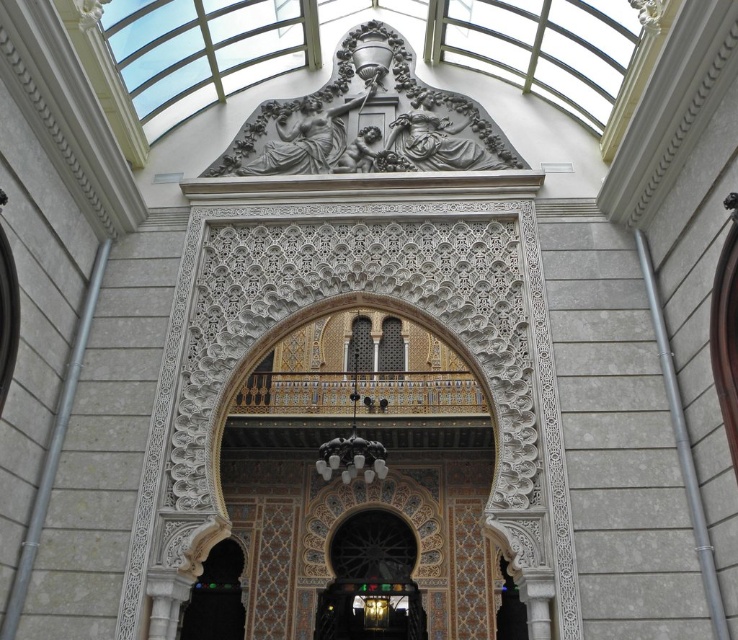
Does metallic gold door at lower center have a lesser width compared to dark wood door at lower left?

Indeed, metallic gold door at lower center has a lesser width compared to dark wood door at lower left.

Does metallic gold door at lower center have a smaller size compared to dark wood door at lower left?

→ Correct, metallic gold door at lower center occupies less space than dark wood door at lower left.

Between point (351, 596) and point (204, 609), which one is positioned behind?

Positioned behind is point (351, 596).

Find the location of `metallic gold door at lower center`. metallic gold door at lower center is located at coordinates (369, 611).

Is gray stone relief at upper center bigger than metallic gold door at lower center?

Yes.

Is gray stone relief at upper center to the right of metallic gold door at lower center from the viewer's perspective?

In fact, gray stone relief at upper center is to the left of metallic gold door at lower center.

Measure the distance between point (356, 100) and camera.

They are 58.84 meters apart.

You are a GUI agent. You are given a task and a screenshot of the screen. Output one action in this format:
    pyautogui.click(x=<x>, y=<y>)
    Task: Click on the gray stone relief at upper center
    
    Given the screenshot: What is the action you would take?
    pyautogui.click(x=368, y=122)

Is point (455, 104) positioned behind point (221, 544)?

No, it is in front of (221, 544).

Is gray stone relief at upper center shorter than dark wood door at lower left?

Indeed, gray stone relief at upper center has a lesser height compared to dark wood door at lower left.

Locate an element on the screen. gray stone relief at upper center is located at coordinates (368, 122).

The height and width of the screenshot is (640, 738). I want to click on gray stone relief at upper center, so click(x=368, y=122).